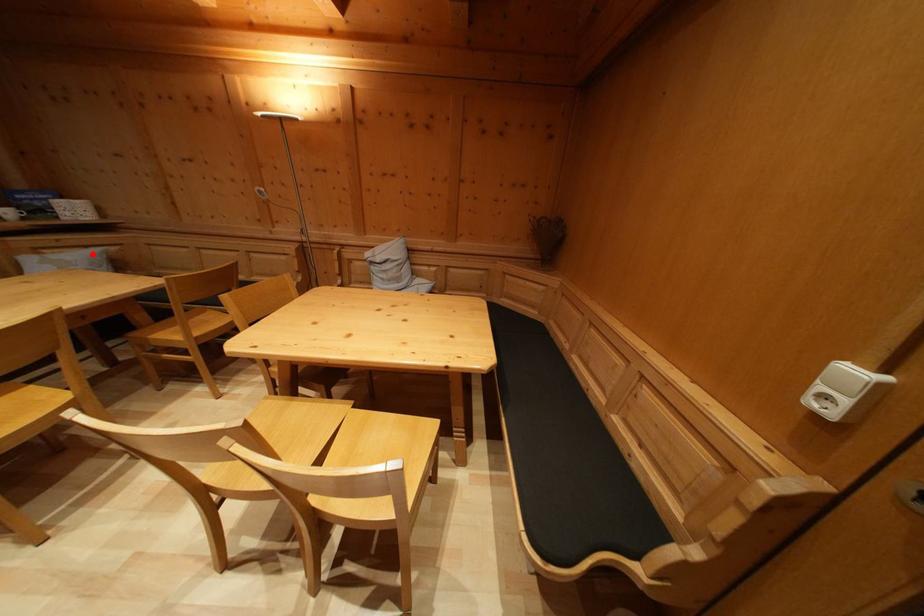
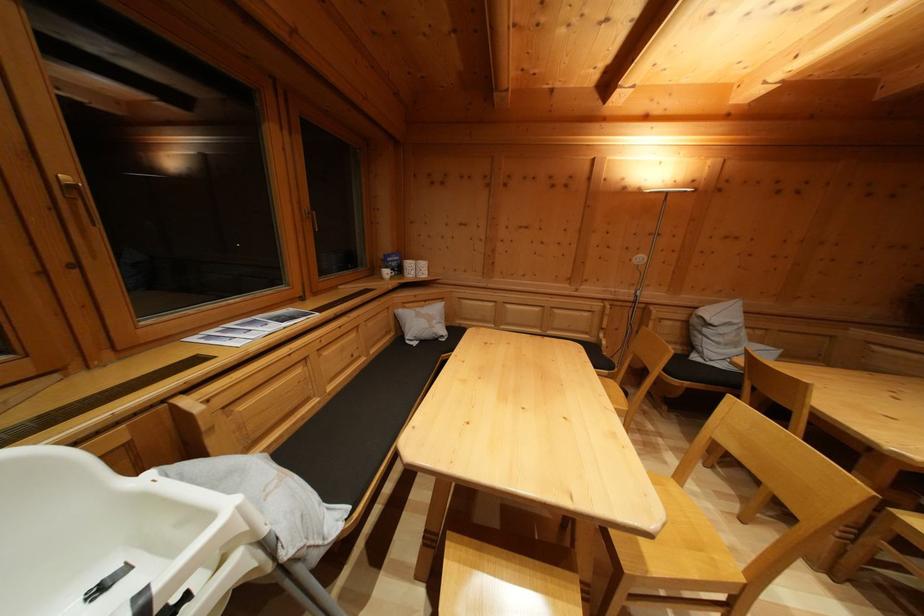
Question: I am providing you with two images of the same scene from different viewpoints. In image1, a red point is highlighted. Considering the same 3D point in image2, which of the following is correct?

Choices:
 (A) It is closer
 (B) It is farther

Answer: (A)